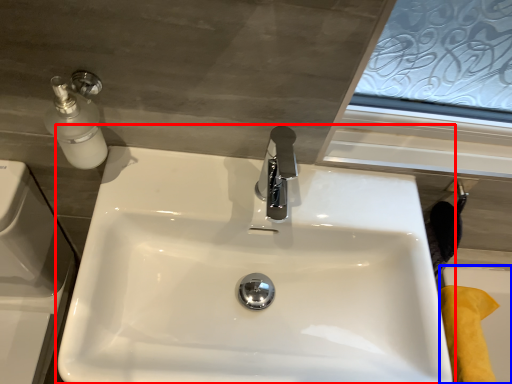
Question: Which object is further to the camera taking this photo, sink (highlighted by a red box) or bath (highlighted by a blue box)?

Choices:
 (A) sink
 (B) bath

Answer: (B)